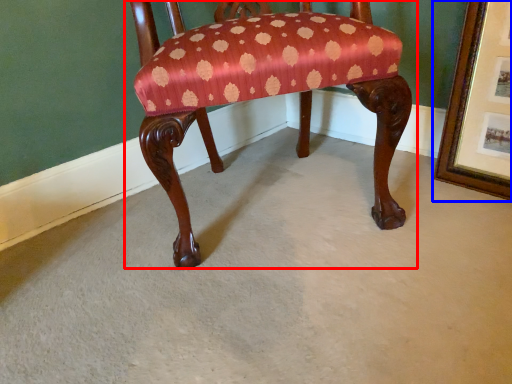
Question: Which point is closer to the camera, chair (highlighted by a red box) or picture frame (highlighted by a blue box)?

Choices:
 (A) chair
 (B) picture frame

Answer: (A)